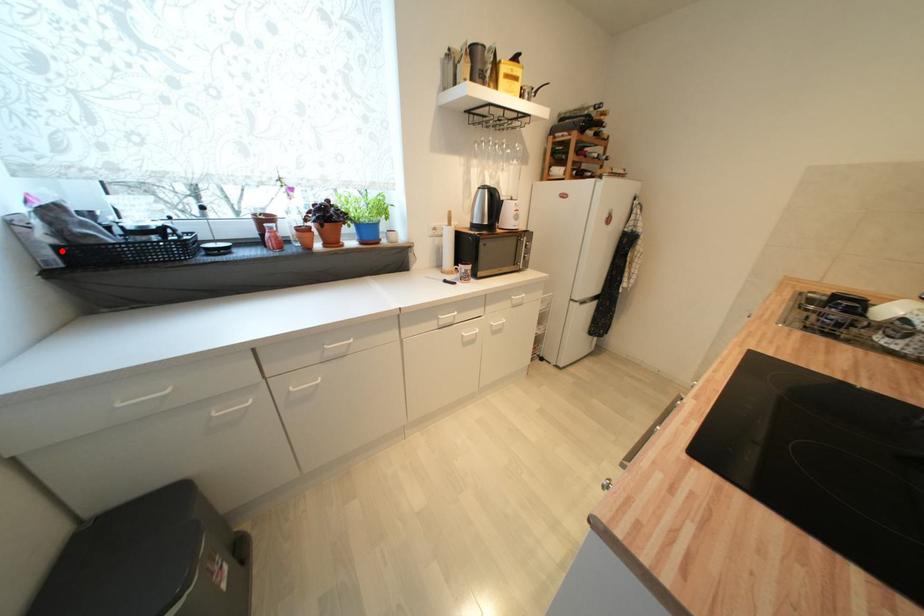
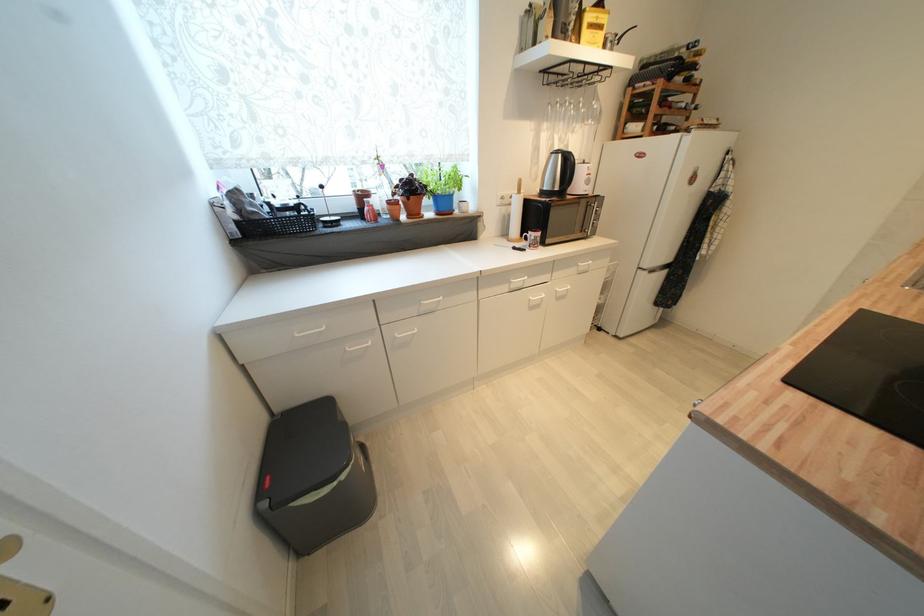
Where in the second image is the point corresponding to the highlighted location from the first image?

(242, 225)